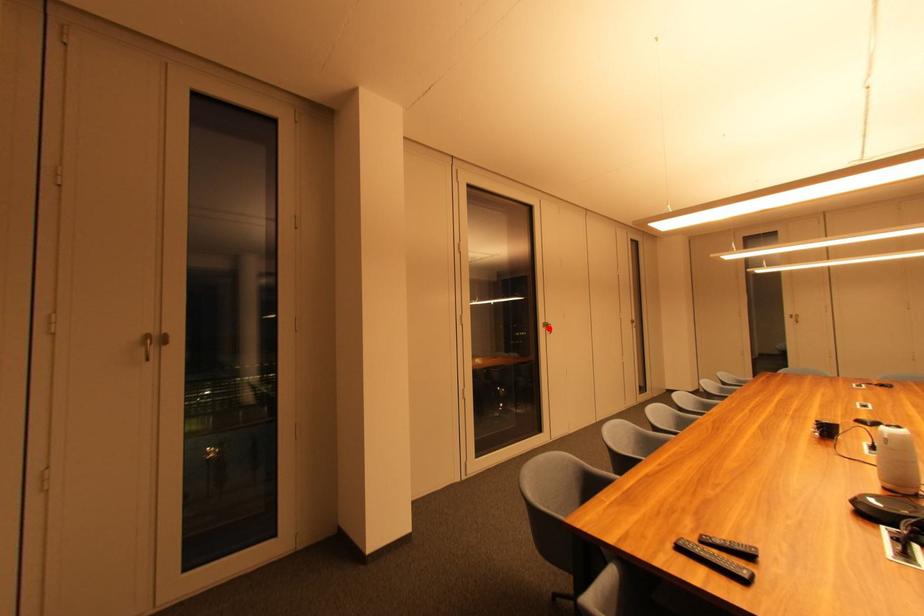
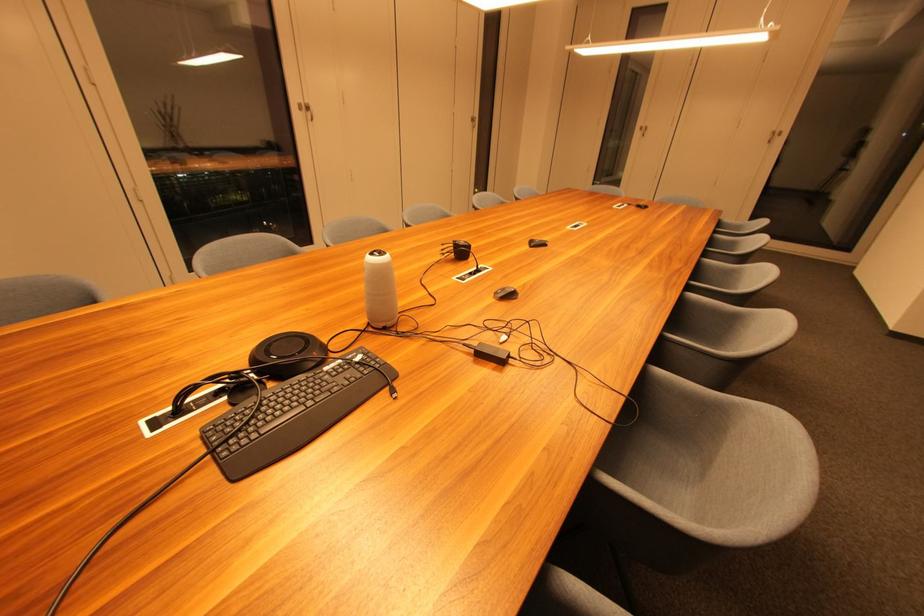
Question: I am providing you with two images of the same scene from different viewpoints. In image1, a red point is highlighted. Considering the same 3D point in image2, which of the following is correct?

Choices:
 (A) It is closer
 (B) It is farther

Answer: (A)